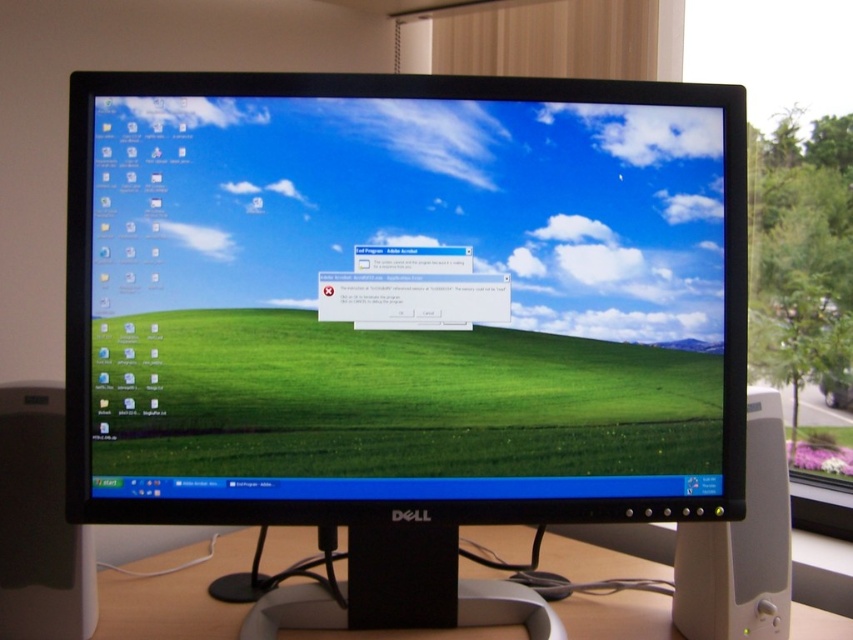
Question: Can you confirm if matte plastic monitor at center is bigger than white plastic computer desk at center?

Choices:
 (A) no
 (B) yes

Answer: (A)

Question: From the image, what is the correct spatial relationship of matte plastic monitor at center in relation to white plastic computer desk at center?

Choices:
 (A) right
 (B) left

Answer: (B)

Question: From the image, what is the correct spatial relationship of matte plastic monitor at center in relation to white plastic computer desk at center?

Choices:
 (A) right
 (B) left

Answer: (B)